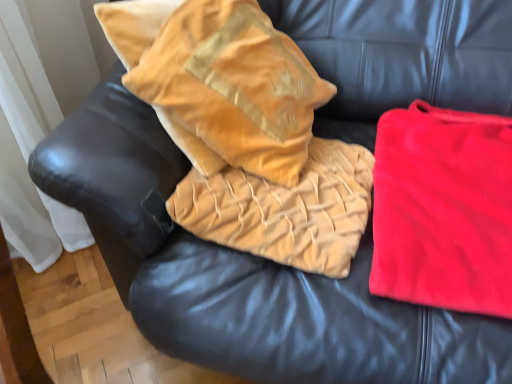
Question: Is velvet gold throw pillow at upper left behind velvet gold pillow at center?

Choices:
 (A) yes
 (B) no

Answer: (B)

Question: From the image's perspective, is velvet gold throw pillow at upper left located beneath velvet gold pillow at center?

Choices:
 (A) yes
 (B) no

Answer: (B)

Question: Is velvet gold throw pillow at upper left smaller than velvet gold pillow at center?

Choices:
 (A) no
 (B) yes

Answer: (A)

Question: Considering the relative sizes of velvet gold throw pillow at upper left and velvet gold pillow at center in the image provided, is velvet gold throw pillow at upper left wider than velvet gold pillow at center?

Choices:
 (A) no
 (B) yes

Answer: (A)

Question: Is velvet gold throw pillow at upper left shorter than velvet gold pillow at center?

Choices:
 (A) yes
 (B) no

Answer: (B)

Question: Looking at the image, does velvet gold pillow at center seem bigger or smaller compared to red velvet blanket at right?

Choices:
 (A) small
 (B) big

Answer: (A)

Question: Considering the relative positions of velvet gold pillow at center and red velvet blanket at right in the image provided, is velvet gold pillow at center to the left or to the right of red velvet blanket at right?

Choices:
 (A) left
 (B) right

Answer: (A)

Question: Considering the positions of point (249, 193) and point (440, 243), is point (249, 193) closer or farther from the camera than point (440, 243)?

Choices:
 (A) closer
 (B) farther

Answer: (B)

Question: Considering the positions of velvet gold pillow at center and red velvet blanket at right in the image, is velvet gold pillow at center taller or shorter than red velvet blanket at right?

Choices:
 (A) tall
 (B) short

Answer: (A)

Question: From the image's perspective, is velvet gold throw pillow at upper left located above or below velvet gold pillow at center?

Choices:
 (A) below
 (B) above

Answer: (B)

Question: Visually, is velvet gold throw pillow at upper left positioned to the left or to the right of velvet gold pillow at center?

Choices:
 (A) left
 (B) right

Answer: (A)

Question: Is velvet gold throw pillow at upper left spatially inside velvet gold pillow at center, or outside of it?

Choices:
 (A) outside
 (B) inside

Answer: (A)

Question: Is velvet gold throw pillow at upper left taller or shorter than velvet gold pillow at center?

Choices:
 (A) short
 (B) tall

Answer: (B)

Question: From the image's perspective, is red velvet blanket at right positioned above or below velvet gold throw pillow at upper left?

Choices:
 (A) above
 (B) below

Answer: (B)

Question: In terms of size, does red velvet blanket at right appear bigger or smaller than velvet gold throw pillow at upper left?

Choices:
 (A) big
 (B) small

Answer: (B)